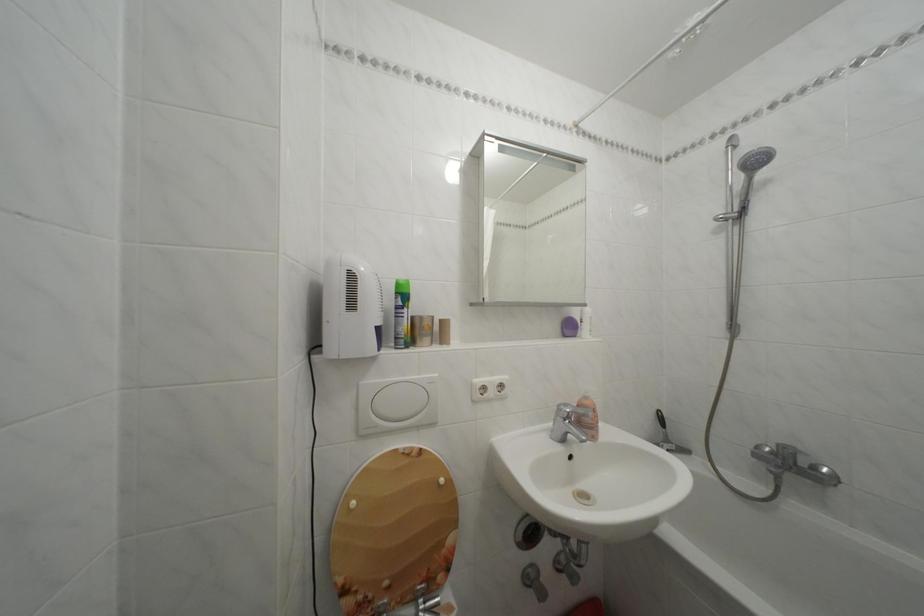
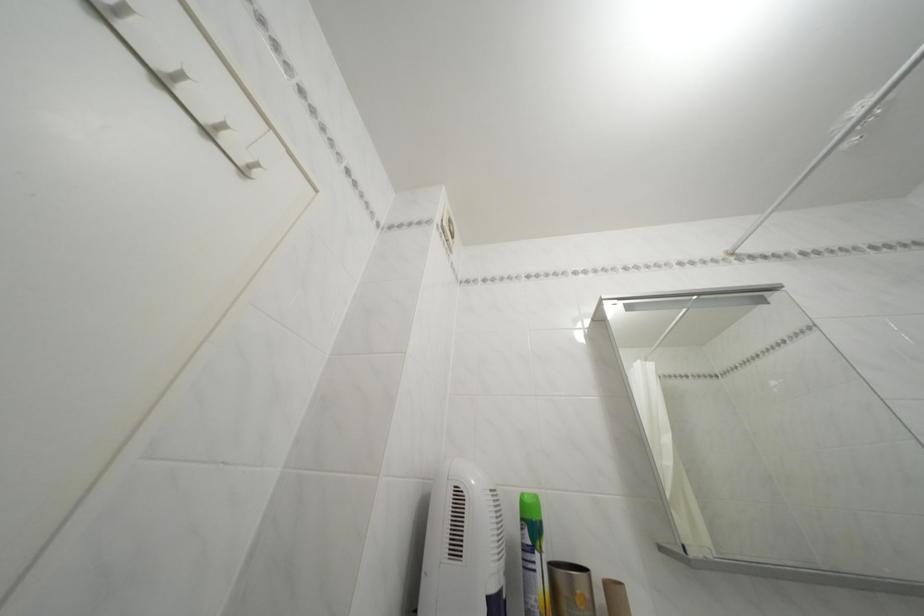
The first image is from the beginning of the video and the second image is from the end. How did the camera likely rotate when shooting the video?

The camera rotated toward left-up.